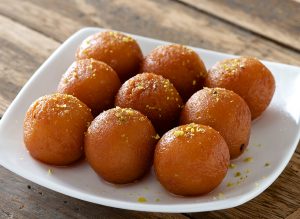
This screenshot has width=300, height=219. In order to click on white dish in this screenshot , I will do `click(288, 81)`, `click(67, 56)`, `click(13, 125)`.